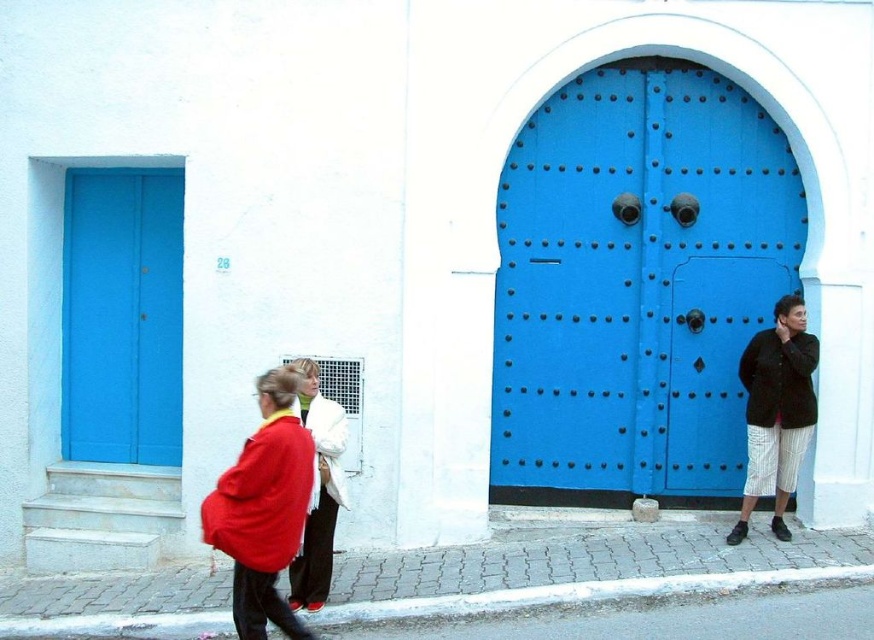
Question: Can you confirm if black textured jacket at right is positioned to the right of matte red sweatshirt at lower left?

Choices:
 (A) yes
 (B) no

Answer: (A)

Question: Which point is closer to the camera?

Choices:
 (A) (122, 257)
 (B) (785, 356)
 (C) (286, 502)

Answer: (C)

Question: Is the position of black textured jacket at right more distant than that of white cotton sweatshirt at center?

Choices:
 (A) yes
 (B) no

Answer: (A)

Question: Which object is positioned farthest from the matte red coat at center?

Choices:
 (A) white cotton sweatshirt at center
 (B) black textured jacket at right
 (C) dark brown cotton sweatshirt at right

Answer: (C)

Question: From the image, what is the correct spatial relationship of black textured jacket at right in relation to dark brown cotton sweatshirt at right?

Choices:
 (A) below
 (B) above

Answer: (A)

Question: Which of these objects is positioned closest to the matte blue door at left?

Choices:
 (A) dark brown cotton sweatshirt at right
 (B) matte red coat at center

Answer: (B)